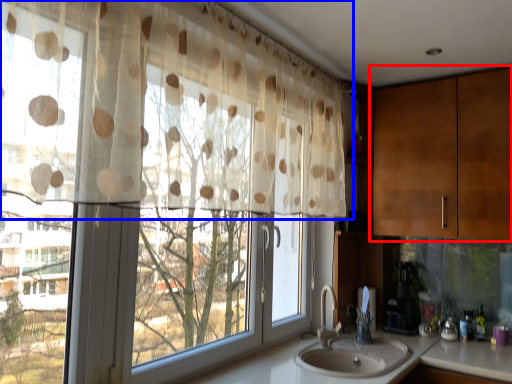
Question: Which point is further to the camera, cabinetry (highlighted by a red box) or curtain (highlighted by a blue box)?

Choices:
 (A) cabinetry
 (B) curtain

Answer: (A)